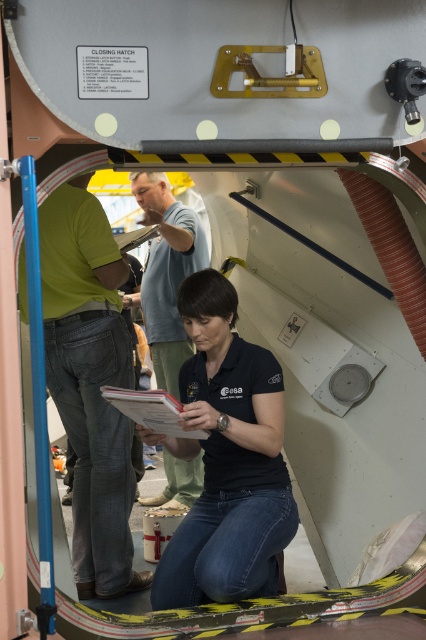
Is point (180, 387) closer to viewer compared to point (150, 426)?

No, it is not.

Can you confirm if black matte shirt at center is shorter than white paper clipboard at lower center?

No, black matte shirt at center is not shorter than white paper clipboard at lower center.

Between point (273, 368) and point (175, 416), which one is positioned in front?

Point (175, 416) is more forward.

Where is `black matte shirt at center`? black matte shirt at center is located at coordinates (227, 460).

Is point (152, 184) positioned in front of point (146, 228)?

Yes.

Does light blue t-shirt at center have a lesser width compared to matte white clipboard at center?

Incorrect, light blue t-shirt at center's width is not less than matte white clipboard at center's.

Between point (161, 182) and point (129, 236), which one is positioned behind?

The point (129, 236) is more distant.

Where is `light blue t-shirt at center`? Image resolution: width=426 pixels, height=640 pixels. light blue t-shirt at center is located at coordinates (166, 273).

Between green matte shirt at left and light blue t-shirt at center, which one appears on the right side from the viewer's perspective?

Positioned to the right is light blue t-shirt at center.

Looking at this image, can you confirm if green matte shirt at left is bigger than light blue t-shirt at center?

Correct, green matte shirt at left is larger in size than light blue t-shirt at center.

Who is more forward, (106, 451) or (178, 502)?

Point (106, 451) is more forward.

The height and width of the screenshot is (640, 426). Find the location of `green matte shirt at left`. green matte shirt at left is located at coordinates (89, 381).